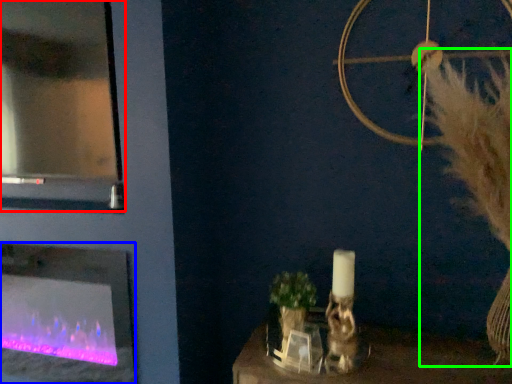
Question: Which object is the closest to the glass door (highlighted by a red box)? Choose among these: fireplace (highlighted by a blue box) or fur (highlighted by a green box).

Choices:
 (A) fireplace
 (B) fur

Answer: (A)